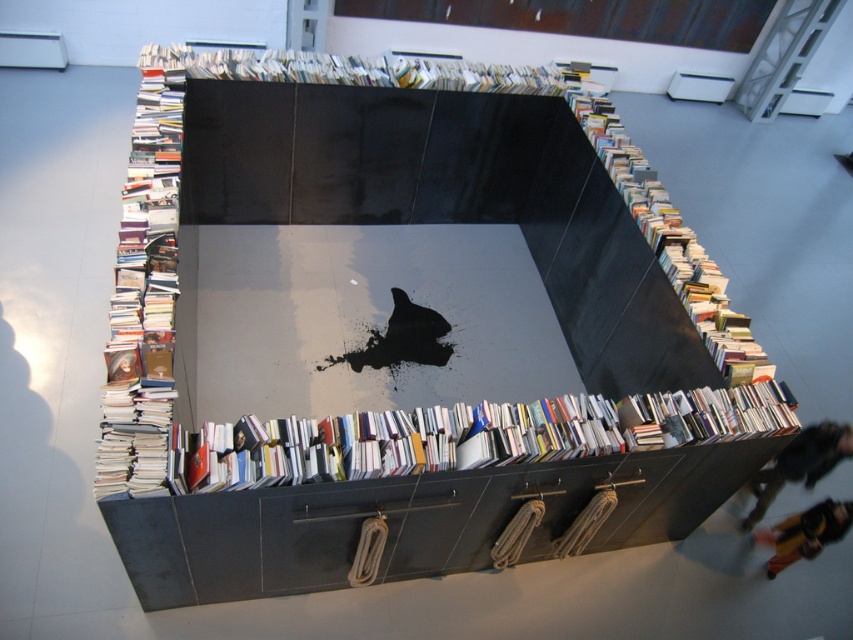
Question: Which object appears farthest from the camera in this image?

Choices:
 (A) yellow fabric person at lower right
 (B) glossy black bookshelf at center
 (C) yellow-orange pants at lower right

Answer: (A)

Question: Based on their relative distances, which object is nearer to the yellow fabric person at lower right?

Choices:
 (A) glossy black bookshelf at center
 (B) yellow-orange pants at lower right

Answer: (B)

Question: Which of the following is the farthest from the observer?

Choices:
 (A) yellow-orange pants at lower right
 (B) yellow fabric person at lower right

Answer: (B)

Question: Is yellow fabric person at lower right bigger than yellow-orange pants at lower right?

Choices:
 (A) yes
 (B) no

Answer: (B)

Question: In this image, where is glossy black bookshelf at center located relative to yellow fabric person at lower right?

Choices:
 (A) left
 (B) right

Answer: (A)

Question: Observing the image, what is the correct spatial positioning of yellow fabric person at lower right in reference to yellow-orange pants at lower right?

Choices:
 (A) above
 (B) below

Answer: (A)